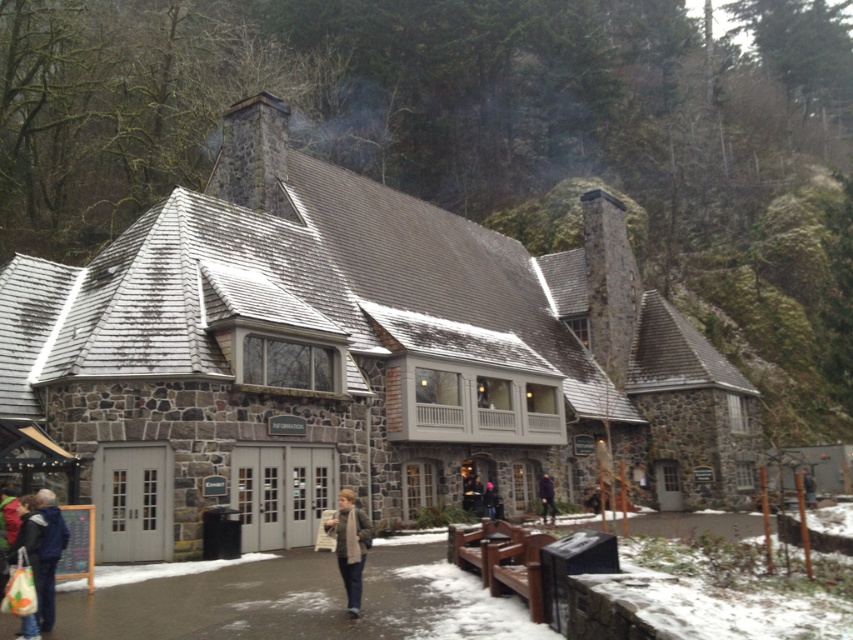
Is the position of green wool scarf at center less distant than that of purple matte jacket at center?

Yes, green wool scarf at center is closer to the viewer.

Is point (357, 579) closer to viewer compared to point (550, 506)?

Yes, it is in front of point (550, 506).

This screenshot has height=640, width=853. I want to click on green wool scarf at center, so click(350, 545).